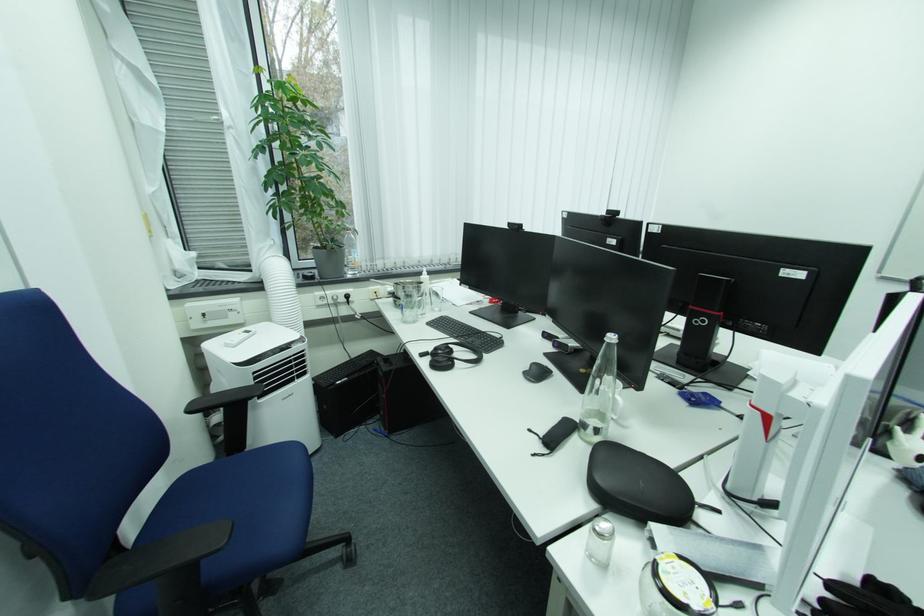
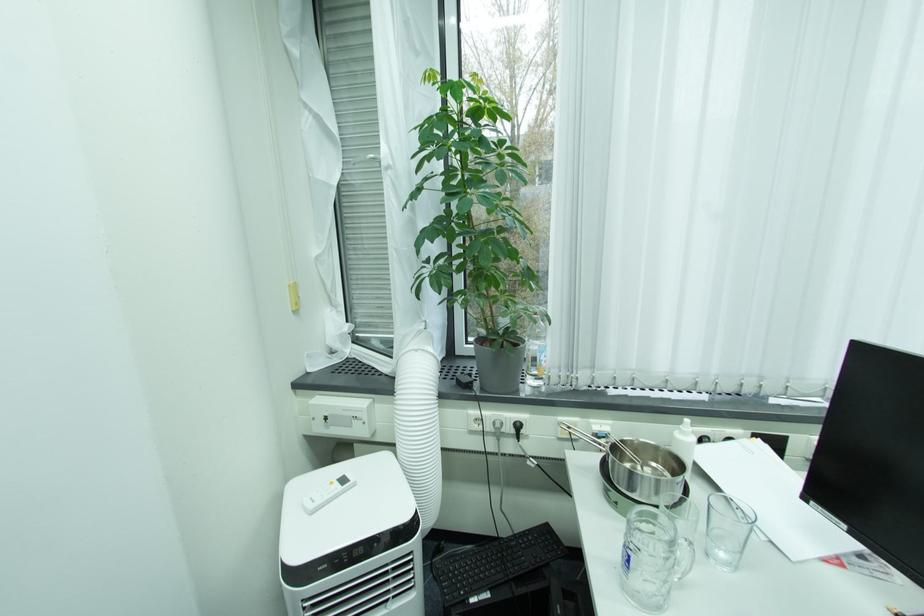
Question: The camera is either moving clockwise (left) or counter-clockwise (right) around the object. The first image is from the beginning of the video and the second image is from the end. Is the camera moving left or right when shooting the video?

Choices:
 (A) Left
 (B) Right

Answer: (B)